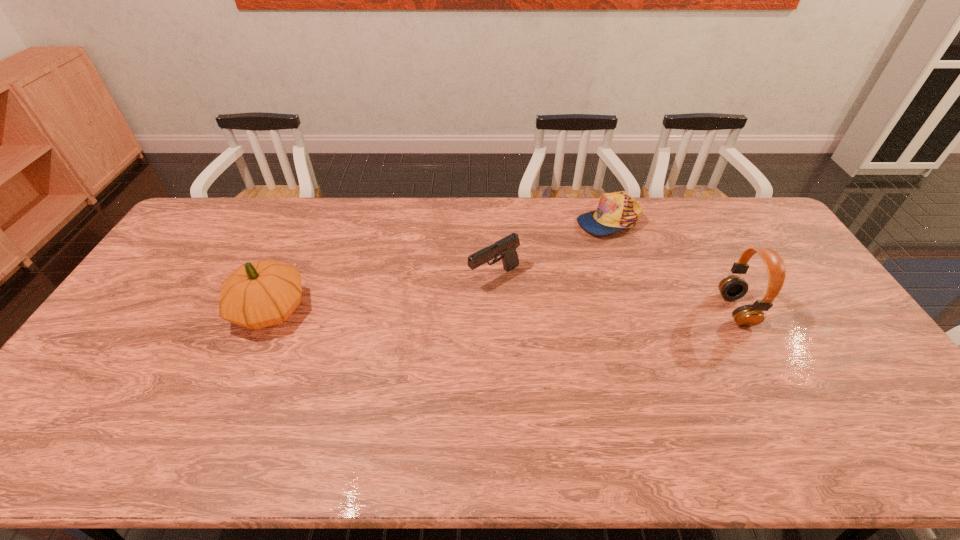
Find the location of a particular element. The height and width of the screenshot is (540, 960). vacant space located on the ear cups of the rightmost object is located at coordinates (644, 310).

In order to click on vacant area situated on the ear cups of the rightmost object in this screenshot , I will do `click(597, 310)`.

You are a GUI agent. You are given a task and a screenshot of the screen. Output one action in this format:
    pyautogui.click(x=<x>, y=<y>)
    Task: Click on the free location located 0.260m on the ear cups of the rightmost object
    This screenshot has height=540, width=960.
    Given the screenshot: What is the action you would take?
    pyautogui.click(x=635, y=310)

Locate an element on the screen. Image resolution: width=960 pixels, height=540 pixels. free space located 0.300m aim along the barrel of the pistol is located at coordinates [x=389, y=333].

What are the coordinates of `free point located 0.080m aim along the barrel of the pistol` in the screenshot? It's located at (453, 298).

Locate an element on the screen. vacant area located aim along the barrel of the pistol is located at coordinates (453, 298).

Where is `vacant point located on the bill of the shortest object`? This screenshot has height=540, width=960. vacant point located on the bill of the shortest object is located at coordinates (546, 292).

Locate an element on the screen. The height and width of the screenshot is (540, 960). blank space located on the bill of the shortest object is located at coordinates (539, 302).

Find the location of `free space located 0.090m on the bill of the shortest object`. free space located 0.090m on the bill of the shortest object is located at coordinates (583, 250).

This screenshot has width=960, height=540. I want to click on object present at the far edge, so click(616, 211).